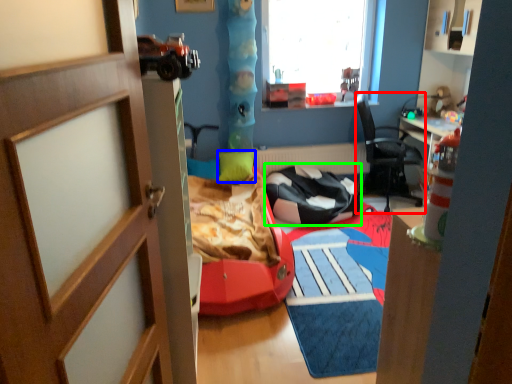
Question: Estimate the real-world distances between objects in this image. Which object is closer to chair (highlighted by a red box), pillow (highlighted by a blue box) or chair (highlighted by a green box)?

Choices:
 (A) pillow
 (B) chair

Answer: (B)